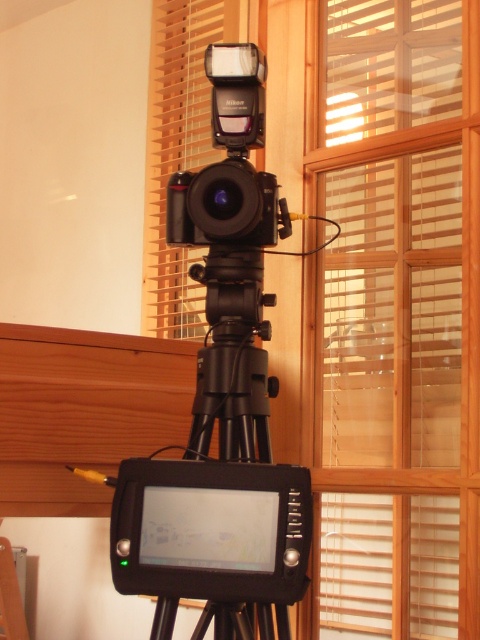
Question: Which of the following is the closest to the observer?

Choices:
 (A) black matte camera at center
 (B) wooden blinds at center

Answer: (B)

Question: Is wooden blinds at center bigger than black matte camera at center?

Choices:
 (A) yes
 (B) no

Answer: (A)

Question: Is wooden blinds at center to the right of black matte camera at center from the viewer's perspective?

Choices:
 (A) no
 (B) yes

Answer: (B)

Question: Which object appears closest to the camera in this image?

Choices:
 (A) wooden blinds at center
 (B) black matte camera at center

Answer: (A)

Question: Does wooden blinds at center have a smaller size compared to black matte camera at center?

Choices:
 (A) yes
 (B) no

Answer: (B)